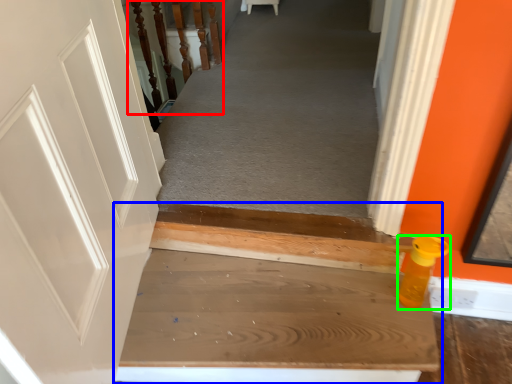
Question: Based on their relative distances, which object is farther from rail (highlighted by a red box)? Choose from stairs (highlighted by a blue box) and bottle (highlighted by a green box).

Choices:
 (A) stairs
 (B) bottle

Answer: (B)